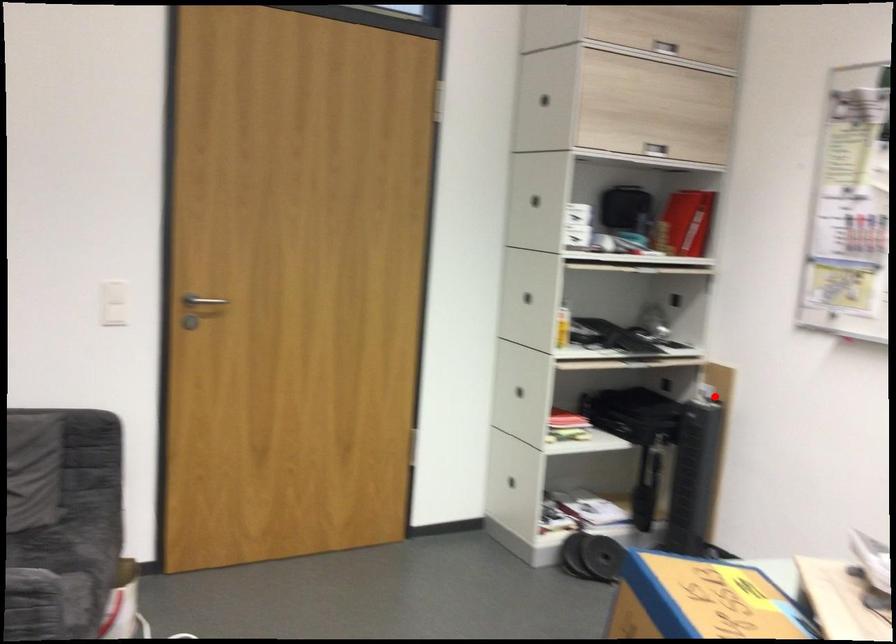
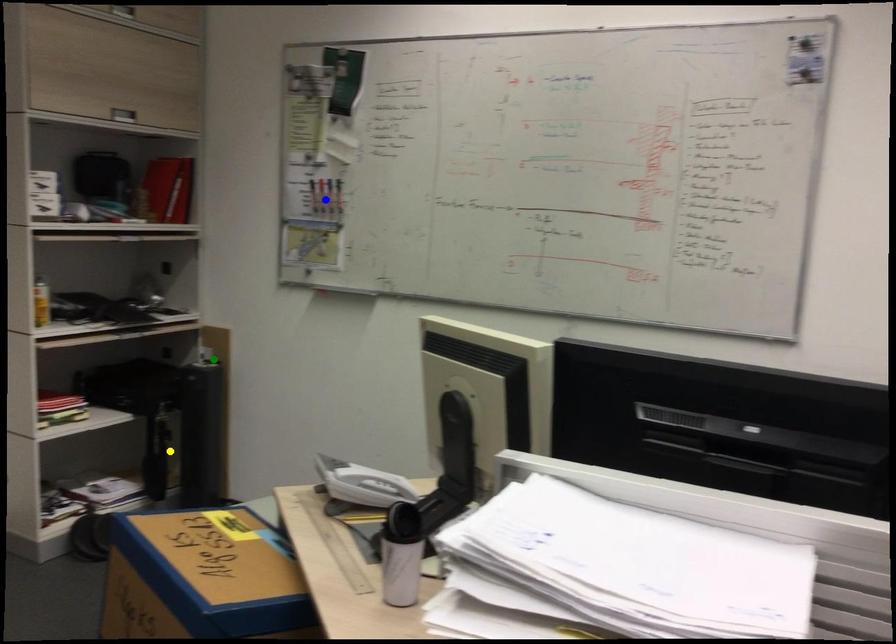
Question: I am providing you with two images of the same scene from different viewpoints. A red point is marked on the first image. You are given multiple points on the second image. Which mark in image 2 goes with the point in image 1?

Choices:
 (A) green point
 (B) blue point
 (C) yellow point

Answer: (A)